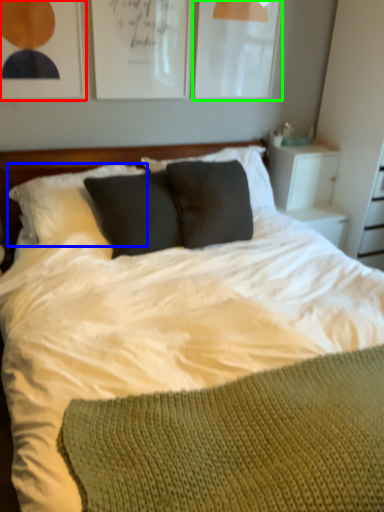
Question: Considering the real-world distances, which object is farthest from picture frame (highlighted by a red box)? pillow (highlighted by a blue box) or picture frame (highlighted by a green box)?

Choices:
 (A) pillow
 (B) picture frame

Answer: (B)